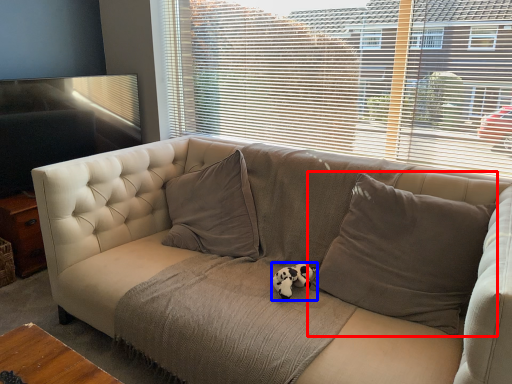
Question: Which object appears farthest to the camera in this image, pillow (highlighted by a red box) or animal (highlighted by a blue box)?

Choices:
 (A) pillow
 (B) animal

Answer: (B)